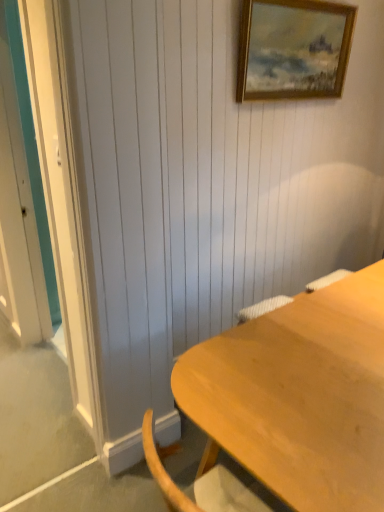
What is the approximate height of gold-framed painting at upper center?

gold-framed painting at upper center is 52.12 centimeters in height.

What do you see at coordinates (293, 49) in the screenshot?
I see `gold-framed painting at upper center` at bounding box center [293, 49].

Locate an element on the screen. This screenshot has width=384, height=512. gold-framed painting at upper center is located at coordinates (293, 49).

Describe the element at coordinates (299, 396) in the screenshot. Image resolution: width=384 pixels, height=512 pixels. I see `light wood desk at lower right` at that location.

You are a GUI agent. You are given a task and a screenshot of the screen. Output one action in this format:
    pyautogui.click(x=<x>, y=<y>)
    Task: Click on the light wood desk at lower right
    
    Given the screenshot: What is the action you would take?
    pyautogui.click(x=299, y=396)

Where is `gold-framed painting at upper center`? The height and width of the screenshot is (512, 384). gold-framed painting at upper center is located at coordinates (293, 49).

Which object is positioned more to the left, gold-framed painting at upper center or light wood desk at lower right?

Positioned to the left is light wood desk at lower right.

Is the position of gold-framed painting at upper center more distant than that of light wood desk at lower right?

Yes.

Considering the positions of point (295, 22) and point (366, 377), is point (295, 22) closer or farther from the camera than point (366, 377)?

Point (295, 22).

From the image's perspective, which object appears higher, gold-framed painting at upper center or light wood desk at lower right?

gold-framed painting at upper center, from the image's perspective.

From a real-world perspective, is gold-framed painting at upper center on top of light wood desk at lower right?

Yes, from a real-world perspective, gold-framed painting at upper center is over light wood desk at lower right

Considering the sizes of gold-framed painting at upper center and light wood desk at lower right in the image, is gold-framed painting at upper center wider or thinner than light wood desk at lower right?

Considering their sizes, gold-framed painting at upper center looks slimmer than light wood desk at lower right.

Can you confirm if gold-framed painting at upper center is taller than light wood desk at lower right?

No.

In terms of size, does gold-framed painting at upper center appear bigger or smaller than light wood desk at lower right?

In the image, gold-framed painting at upper center appears to be smaller than light wood desk at lower right.

Do you think gold-framed painting at upper center is within light wood desk at lower right, or outside of it?

gold-framed painting at upper center exists outside the volume of light wood desk at lower right.

Is gold-framed painting at upper center far away from light wood desk at lower right?

Yes, gold-framed painting at upper center is far from light wood desk at lower right.

Is gold-framed painting at upper center oriented away from light wood desk at lower right?

That's not correct — gold-framed painting at upper center is not looking away from light wood desk at lower right.

How different are the orientations of gold-framed painting at upper center and light wood desk at lower right in degrees?

The angular difference between gold-framed painting at upper center and light wood desk at lower right is 90 degrees.

This screenshot has width=384, height=512. In order to click on picture frame lying above the light wood desk at lower right (from the image's perspective) in this screenshot , I will do `click(293, 49)`.

Considering the positions of objects light wood desk at lower right and gold-framed painting at upper center in the image provided, who is more to the right, light wood desk at lower right or gold-framed painting at upper center?

gold-framed painting at upper center is more to the right.

Is light wood desk at lower right in front of or behind gold-framed painting at upper center in the image?

In the image, light wood desk at lower right appears in front of gold-framed painting at upper center.

Is point (291, 378) farther from camera compared to point (272, 49)?

That is False.

From the image's perspective, is light wood desk at lower right located above gold-framed painting at upper center?

Actually, light wood desk at lower right appears below gold-framed painting at upper center in the image.

From a real-world perspective, which object rests below the other?

From a 3D spatial view, light wood desk at lower right is below.

Consider the image. Considering the relative sizes of light wood desk at lower right and gold-framed painting at upper center in the image provided, is light wood desk at lower right thinner than gold-framed painting at upper center?

Incorrect, the width of light wood desk at lower right is not less than that of gold-framed painting at upper center.

Is light wood desk at lower right taller or shorter than gold-framed painting at upper center?

light wood desk at lower right is taller than gold-framed painting at upper center.

Can you confirm if light wood desk at lower right is smaller than gold-framed painting at upper center?

No.

Based on the photo, is light wood desk at lower right not inside gold-framed painting at upper center?

light wood desk at lower right lies outside gold-framed painting at upper center's area.

Are light wood desk at lower right and gold-framed painting at upper center located far from each other?

Yes, light wood desk at lower right and gold-framed painting at upper center are quite far apart.

Is light wood desk at lower right turned away from gold-framed painting at upper center?

No, light wood desk at lower right is not facing the opposite direction of gold-framed painting at upper center.

What's the angular difference between light wood desk at lower right and gold-framed painting at upper center's facing directions?

There is a 90-degree angle between the facing directions of light wood desk at lower right and gold-framed painting at upper center.

Find the location of a particular element. This screenshot has height=512, width=384. picture frame on the right side of light wood desk at lower right is located at coordinates (293, 49).

This screenshot has width=384, height=512. In order to click on desk on the left of gold-framed painting at upper center in this screenshot , I will do `click(299, 396)`.

At what (x,y) coordinates should I click in order to perform the action: click on desk in front of the gold-framed painting at upper center. Please return your answer as a coordinate pair (x, y). The width and height of the screenshot is (384, 512). Looking at the image, I should click on (299, 396).